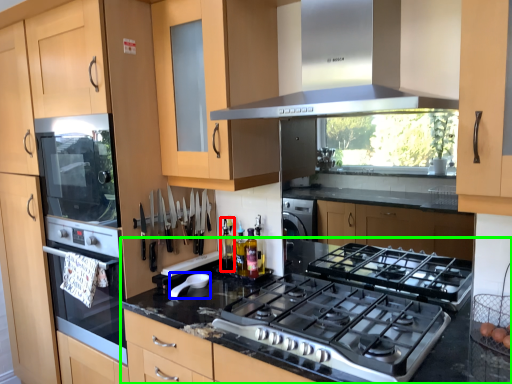
Question: Which object is positioned farthest from bottle (highlighted by a red box)? Select from appliance (highlighted by a blue box) and countertop (highlighted by a green box).

Choices:
 (A) appliance
 (B) countertop

Answer: (B)